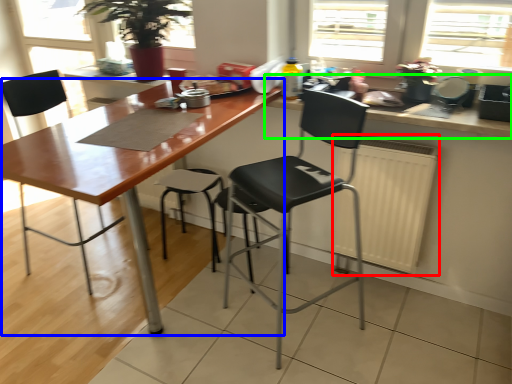
Question: Which object is positioned closest to radiator (highlighted by a red box)? Select from table (highlighted by a blue box) and countertop (highlighted by a green box).

Choices:
 (A) table
 (B) countertop

Answer: (B)